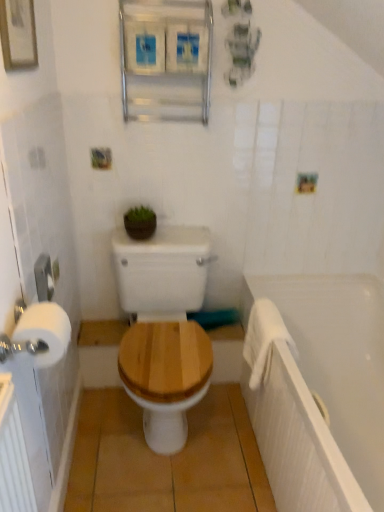
In order to face green matte plant at upper center, should I rotate leftwards or rightwards?

Rotate left and turn 6.722 degrees.

Measure the distance between point (185, 280) and camera.

Point (185, 280) and camera are 6.37 feet apart.

Image resolution: width=384 pixels, height=512 pixels. Describe the element at coordinates (322, 392) in the screenshot. I see `white matte bathtub at right` at that location.

Measure the distance between white matte bathtub at right and camera.

white matte bathtub at right and camera are 1.42 meters apart from each other.

What is the approximate width of metallic silver medicine cabinet at upper center?

metallic silver medicine cabinet at upper center is 4.76 inches in width.

Measure the distance between metallic silver medicine cabinet at upper center and camera.

metallic silver medicine cabinet at upper center is 1.58 meters away from camera.

This screenshot has width=384, height=512. I want to click on white matte toilet paper at left, so click(45, 331).

At what (x,y) coordinates should I click in order to perform the action: click on white soft towel at right. Please return your answer as a coordinate pair (x, y). Looking at the image, I should click on pyautogui.click(x=264, y=340).

Based on the photo, is white plastic towel bar at left located outside wooden toilet seat at center?

Indeed, white plastic towel bar at left is completely outside wooden toilet seat at center.

Is white plastic towel bar at left taller or shorter than wooden toilet seat at center?

Answer: Clearly, white plastic towel bar at left is shorter compared to wooden toilet seat at center.

Would you say white plastic towel bar at left is to the left or to the right of wooden toilet seat at center in the picture?

Clearly, white plastic towel bar at left is on the left of wooden toilet seat at center in the image.

Identify the location of toilet on the right of white plastic towel bar at left. This screenshot has width=384, height=512. (164, 328).

Is white soft towel at right looking in the opposite direction of wooden toilet seat at center?

No, white soft towel at right is not facing away from wooden toilet seat at center.

Is the position of white soft towel at right less distant than that of wooden toilet seat at center?

No.

Which point is more forward, [276,320] or [184,271]?

Positioned in front is point [276,320].

Would you say white soft towel at right is to the left or to the right of wooden toilet seat at center in the picture?

Based on their positions, white soft towel at right is located to the right of wooden toilet seat at center.

Where is `bath towel above the wooden toilet seat at center (from the image's perspective)`? This screenshot has height=512, width=384. bath towel above the wooden toilet seat at center (from the image's perspective) is located at coordinates (264, 340).

Is wooden toilet seat at center facing away from white soft towel at right?

No, wooden toilet seat at center is not facing away from white soft towel at right.

From the image's perspective, relative to white soft towel at right, is wooden toilet seat at center above or below?

Clearly, from the image's perspective, wooden toilet seat at center is below white soft towel at right.

Between white matte bathtub at right and white plastic towel bar at left, which one appears on the right side from the viewer's perspective?

white matte bathtub at right.

From a real-world perspective, is white matte bathtub at right on top of white plastic towel bar at left?

Actually, white matte bathtub at right is physically below white plastic towel bar at left in the real world.

How different are the orientations of white matte bathtub at right and white plastic towel bar at left in degrees?

white matte bathtub at right and white plastic towel bar at left are facing 178 degrees away from each other.

Considering the positions of points (338, 450) and (38, 300), is point (338, 450) farther from camera compared to point (38, 300)?

Yes.

In terms of width, does white matte toilet paper at left look wider or thinner when compared to wooden toilet seat at center?

white matte toilet paper at left is thinner than wooden toilet seat at center.

Considering their positions, is white matte toilet paper at left located in front of or behind wooden toilet seat at center?

white matte toilet paper at left is positioned closer to the viewer than wooden toilet seat at center.

From the picture: Which object is positioned more to the left, white matte toilet paper at left or wooden toilet seat at center?

white matte toilet paper at left.

Is metallic silver medicine cabinet at upper center oriented towards white soft towel at right?

No, metallic silver medicine cabinet at upper center is not turned towards white soft towel at right.

The image size is (384, 512). Identify the location of medicine cabinet lying above the white soft towel at right (from the image's perspective). (166, 59).

Considering the relative sizes of metallic silver medicine cabinet at upper center and white soft towel at right in the image provided, is metallic silver medicine cabinet at upper center taller than white soft towel at right?

Yes, metallic silver medicine cabinet at upper center is taller than white soft towel at right.

Does metallic silver medicine cabinet at upper center appear on the right side of wooden toilet seat at center?

Correct, you'll find metallic silver medicine cabinet at upper center to the right of wooden toilet seat at center.

In order to click on toilet that is on the left side of metallic silver medicine cabinet at upper center in this screenshot , I will do `click(164, 328)`.

Looking at the image, does metallic silver medicine cabinet at upper center seem bigger or smaller compared to wooden toilet seat at center?

Considering their sizes, metallic silver medicine cabinet at upper center takes up less space than wooden toilet seat at center.

Is metallic silver medicine cabinet at upper center not near wooden toilet seat at center?

No, metallic silver medicine cabinet at upper center is not far away from wooden toilet seat at center.

The height and width of the screenshot is (512, 384). Find the location of `towel bar lying on the left of wooden toilet seat at center`. towel bar lying on the left of wooden toilet seat at center is located at coordinates (44, 278).

Identify the location of bath towel located behind the wooden toilet seat at center. (264, 340).

Estimate the real-world distances between objects in this image. Which object is closer to metallic silver medicine cabinet at upper center, white matte bathtub at right or white soft towel at right?

white soft towel at right is closer to metallic silver medicine cabinet at upper center.

From the image, which object appears to be farther from white matte toilet paper at left, white plastic towel bar at left or green matte plant at upper center?

green matte plant at upper center lies further to white matte toilet paper at left than the other object.

Looking at the image, which one is located closer to white plastic towel bar at left, wooden toilet seat at center or white matte toilet paper at left?

white matte toilet paper at left lies closer to white plastic towel bar at left than the other object.

From the image, which object appears to be nearer to white matte bathtub at right, wooden toilet seat at center or green matte plant at upper center?

Among the two, wooden toilet seat at center is located nearer to white matte bathtub at right.

Based on their spatial positions, is metallic silver medicine cabinet at upper center or wooden toilet seat at center further from green matte plant at upper center?

Based on the image, metallic silver medicine cabinet at upper center appears to be further to green matte plant at upper center.

Considering their positions, is white plastic towel bar at left positioned closer to metallic silver medicine cabinet at upper center than white soft towel at right?

Among the two, white plastic towel bar at left is located nearer to metallic silver medicine cabinet at upper center.

Based on the photo, estimate the real-world distances between objects in this image. Which object is closer to white matte toilet paper at left, white matte bathtub at right or white soft towel at right?

Among the two, white soft towel at right is located nearer to white matte toilet paper at left.

When comparing their distances from green matte plant at upper center, does white matte toilet paper at left or metallic silver medicine cabinet at upper center seem closer?

metallic silver medicine cabinet at upper center is positioned closer to the anchor green matte plant at upper center.

Where is `bath towel between metallic silver medicine cabinet at upper center and wooden toilet seat at center from top to bottom`? The image size is (384, 512). bath towel between metallic silver medicine cabinet at upper center and wooden toilet seat at center from top to bottom is located at coordinates (264, 340).

Where is `bath towel between white plastic towel bar at left and white matte bathtub at right from left to right`? The height and width of the screenshot is (512, 384). bath towel between white plastic towel bar at left and white matte bathtub at right from left to right is located at coordinates (264, 340).

Identify the location of towel bar located between white matte toilet paper at left and wooden toilet seat at center in the depth direction. This screenshot has width=384, height=512. (44, 278).

In order to click on toilet between metallic silver medicine cabinet at upper center and white matte bathtub at right vertically in this screenshot , I will do `click(164, 328)`.